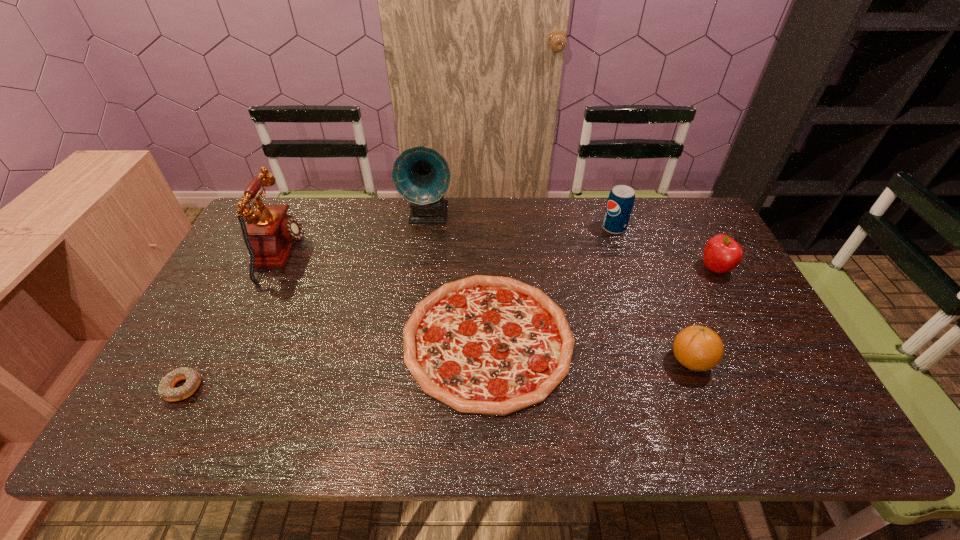
The width and height of the screenshot is (960, 540). I want to click on free spot located 0.050m on the back of the apple, so click(x=703, y=246).

I want to click on free region located 0.150m on the left of the orange, so click(609, 361).

What are the coordinates of `free space located 0.090m on the right of the doughnut` in the screenshot? It's located at (239, 387).

I want to click on free location located on the right of the pizza, so click(x=688, y=340).

This screenshot has width=960, height=540. What are the coordinates of `phonograph_record present at the far edge` in the screenshot? It's located at (421, 175).

Find the location of a particular element. This screenshot has width=960, height=540. telephone at the far edge is located at coordinates (271, 233).

You are a GUI agent. You are given a task and a screenshot of the screen. Output one action in this format:
    pyautogui.click(x=<x>, y=<y>)
    Task: Click on the pop that is positioned at the far edge
    The image size is (960, 540).
    Given the screenshot: What is the action you would take?
    pyautogui.click(x=620, y=202)

Identify the location of object that is at the near edge. (493, 345).

The image size is (960, 540). Identify the location of telephone present at the left edge. (271, 233).

You are a GUI agent. You are given a task and a screenshot of the screen. Output one action in this format:
    pyautogui.click(x=<x>, y=<y>)
    Task: Click on the doughnut that is at the left edge
    
    Given the screenshot: What is the action you would take?
    pyautogui.click(x=166, y=390)